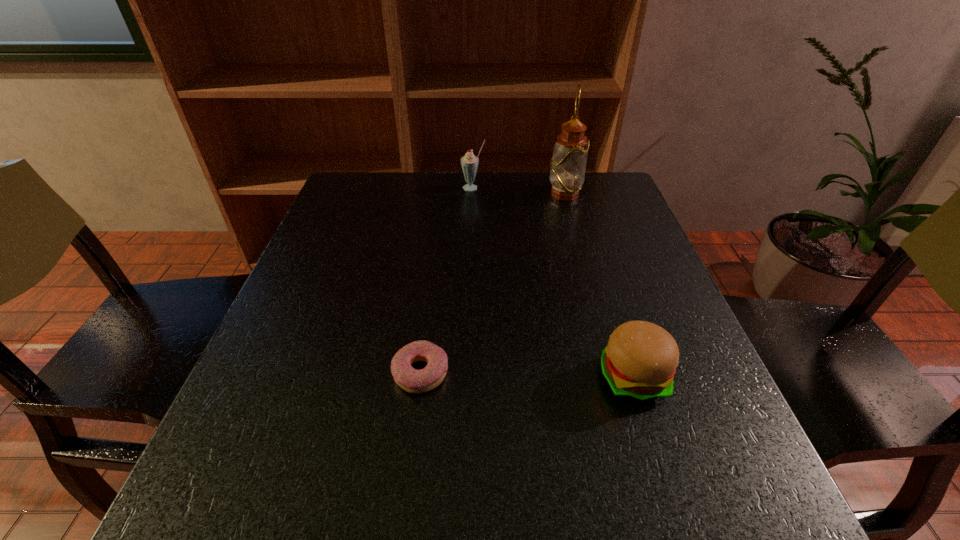
In order to click on vacant area between the milkshake and the doughnut in this screenshot , I will do `click(447, 280)`.

Identify which object is the third closest to the shortest object. Please provide its 2D coordinates. Your answer should be formatted as a tuple, i.e. [(x, y)], where the tuple contains the x and y coordinates of a point satisfying the conditions above.

[(469, 162)]

The height and width of the screenshot is (540, 960). I want to click on object that is the second closest one to the second shortest object, so click(568, 164).

Locate an element on the screen. vacant space that satisfies the following two spatial constraints: 1. on the front side of the third tallest object; 2. on the left side of the shortest object is located at coordinates (420, 377).

What are the coordinates of `free location that satisfies the following two spatial constraints: 1. on the straw side of the third shortest object; 2. on the right side of the oil lamp` in the screenshot? It's located at (473, 194).

In order to click on free space that satisfies the following two spatial constraints: 1. on the straw side of the second tallest object; 2. on the left side of the oil lamp in this screenshot , I will do `click(473, 194)`.

Locate an element on the screen. Image resolution: width=960 pixels, height=540 pixels. free location that satisfies the following two spatial constraints: 1. on the front side of the oil lamp; 2. on the left side of the hamburger is located at coordinates (615, 377).